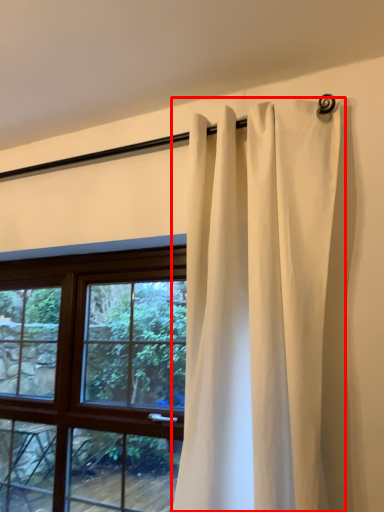
Question: From the image's perspective, what is the correct spatial positioning of curtain (annotated by the red box) in reference to window?

Choices:
 (A) above
 (B) below

Answer: (A)